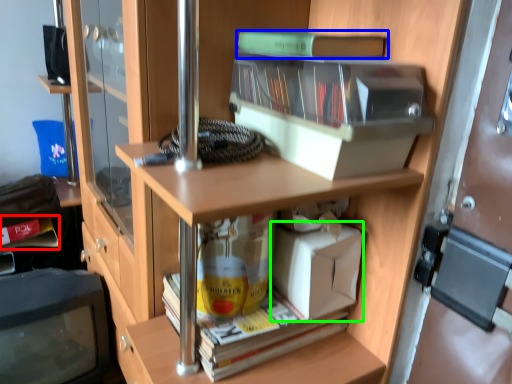
Question: Considering the real-world distances, which object is farthest from book (highlighted by a red box)? book (highlighted by a blue box) or box (highlighted by a green box)?

Choices:
 (A) book
 (B) box

Answer: (A)